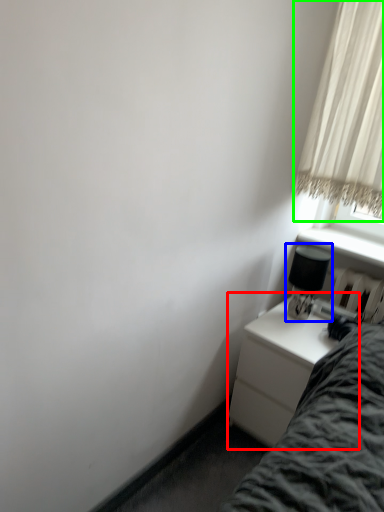
Question: Which is farther away from nightstand (highlighted by a red box)? table lamp (highlighted by a blue box) or curtain (highlighted by a green box)?

Choices:
 (A) table lamp
 (B) curtain

Answer: (B)